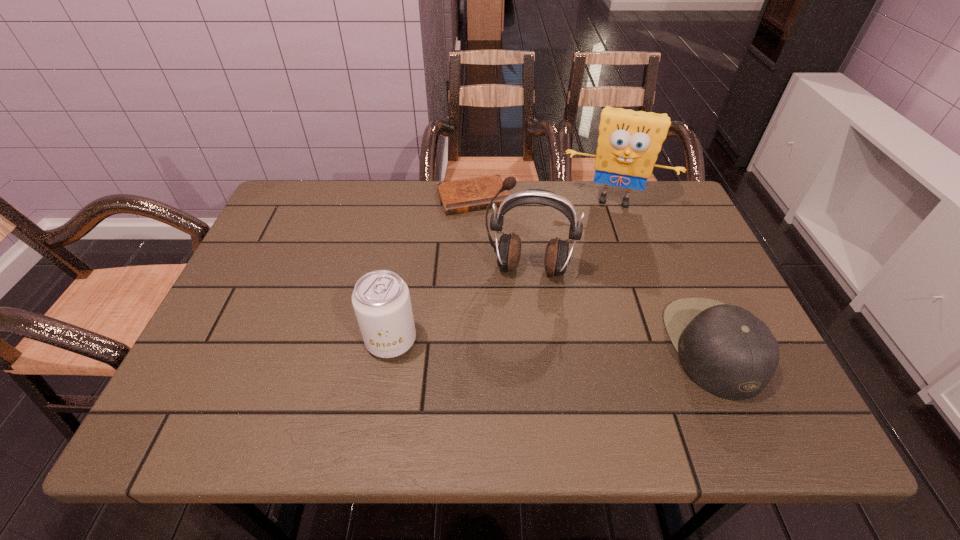
Locate an element on the screen. This screenshot has width=960, height=540. cap at the right edge is located at coordinates (726, 350).

Locate an element on the screen. This screenshot has width=960, height=540. sponge that is at the right edge is located at coordinates (629, 141).

Locate an element on the screen. Image resolution: width=960 pixels, height=540 pixels. object that is at the far right corner is located at coordinates (629, 141).

At what (x,y) coordinates should I click in order to perform the action: click on object positioned at the near right corner. Please return your answer as a coordinate pair (x, y). Image resolution: width=960 pixels, height=540 pixels. Looking at the image, I should click on (726, 350).

Identify the location of vacant space at the far edge of the desktop. (358, 186).

This screenshot has height=540, width=960. I want to click on vacant space at the near edge, so 490,391.

Where is `vacant space at the left edge`? This screenshot has height=540, width=960. vacant space at the left edge is located at coordinates (303, 254).

In the image, there is a desktop. Identify the location of vacant space at the right edge. (656, 265).

Where is `free space at the far left corner of the desktop`? free space at the far left corner of the desktop is located at coordinates (302, 195).

Locate an element on the screen. This screenshot has height=540, width=960. blank space at the far right corner is located at coordinates (631, 202).